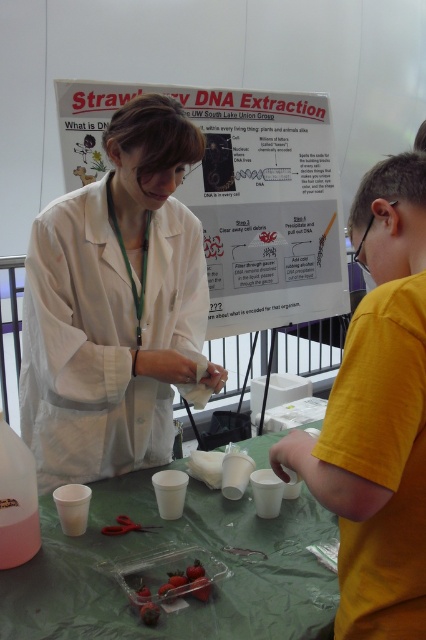
Is white lab coat at center thinner than green plastic table at center?

Yes.

Is the position of white lab coat at center less distant than that of green plastic table at center?

No, white lab coat at center is behind green plastic table at center.

Who is more forward, (x=39, y=372) or (x=219, y=602)?

Point (x=219, y=602)

You are a GUI agent. You are given a task and a screenshot of the screen. Output one action in this format:
    pyautogui.click(x=<x>, y=<y>)
    Task: Click on the white lab coat at center
    
    Given the screenshot: What is the action you would take?
    pyautogui.click(x=114, y=305)

Is white paperboard at center below green plastic table at center?

Actually, white paperboard at center is above green plastic table at center.

In the scene shown: Which of these two, white paperboard at center or green plastic table at center, stands taller?

white paperboard at center

Between point (241, 228) and point (328, 588), which one is positioned behind?

The point (241, 228) is behind.

Where is `white paperboard at center`? white paperboard at center is located at coordinates pos(241,195).

Between white lab coat at center and white paperboard at center, which one is positioned lower?

→ white lab coat at center

Is point (85, 260) farther from viewer compared to point (77, 182)?

No, it is not.

Between point (91, 246) and point (282, 108), which one is positioned in front?

Point (91, 246) is in front.

This screenshot has width=426, height=640. Identify the location of white lab coat at center. (x=114, y=305).